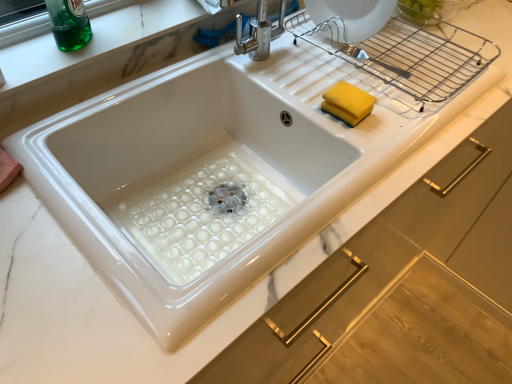
Locate an element on the screen. The height and width of the screenshot is (384, 512). vacant space situated on the left part of yellow sponge at upper right is located at coordinates (292, 97).